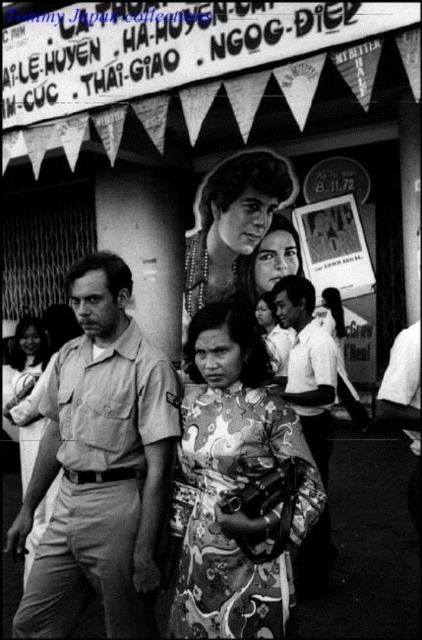
You are standing at the point with coordinates point (40, 436). You want to move to the point with coordinates point (335, 285). Is the point you want to reach behind you or in front of you?

The point with coordinates point (335, 285) is behind point (40, 436), so the point you want to reach is behind you.

You are a photographer at the event and need to position yourself so that the light beige uniform at center and the printed paper poster at center are both in your frame. Which object should you adjust your angle to prioritize capturing first?

The light beige uniform at center is below the printed paper poster at center, so you should prioritize capturing the printed paper poster at center first as it is higher up in the frame.

What is located at the point with coordinates [335,246] in the image?

The printed paper poster at center is located at the point with coordinates [335,246] in the image.